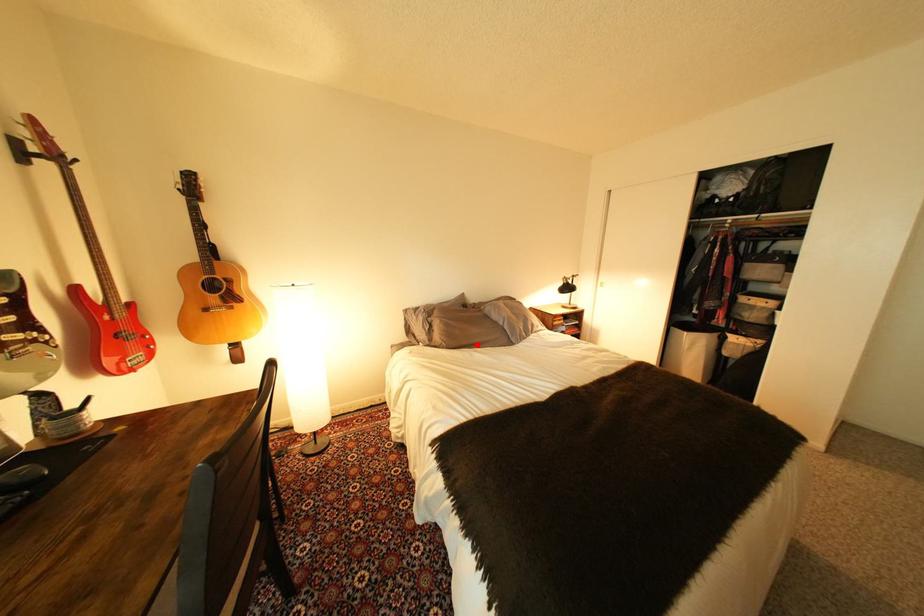
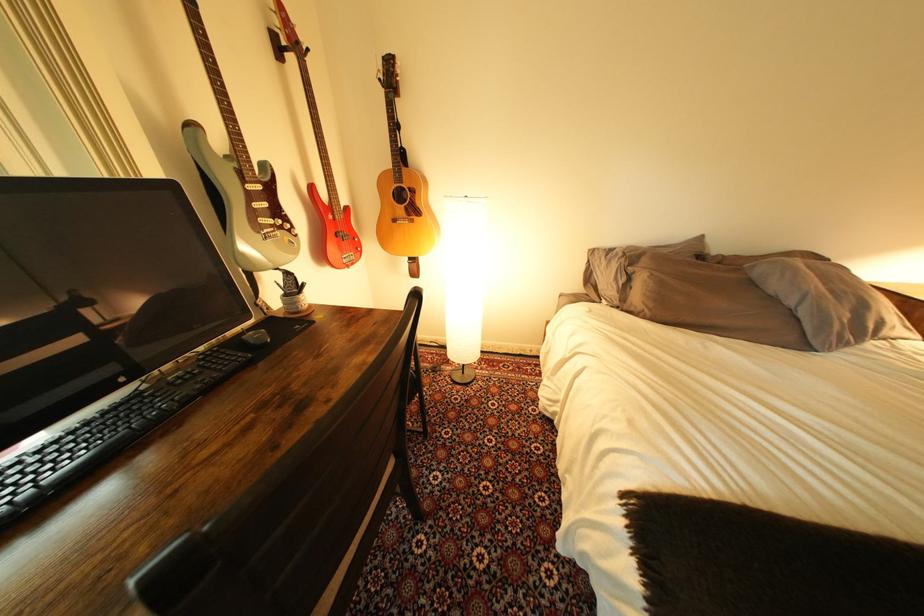
In the second image, find the point that corresponds to the highlighted location in the first image.

(701, 322)